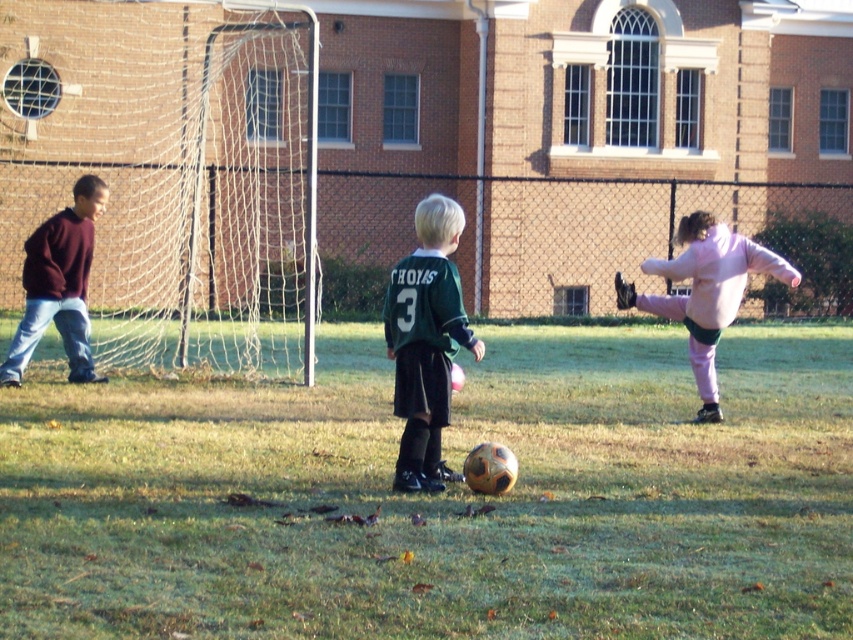
You are a photographer trying to capture a closeup of the soccer ball in the image. There are two points marked in the image. One is at point (73,422) and the other is at point (718,262). Which point should you focus on to ensure the soccer ball is in focus?

Point (73,422) is closer to the camera than point (718,262), so focusing on point (73,422) will ensure the soccer ball is in focus.

You are a photographer trying to capture a photo of the soccer game. You notice the pink fleece jacket at right and the maroon sweater at left in your frame. Which clothing item is closer to the camera?

The pink fleece jacket at right is positioned under the maroon sweater at left, meaning it is closer to the camera.